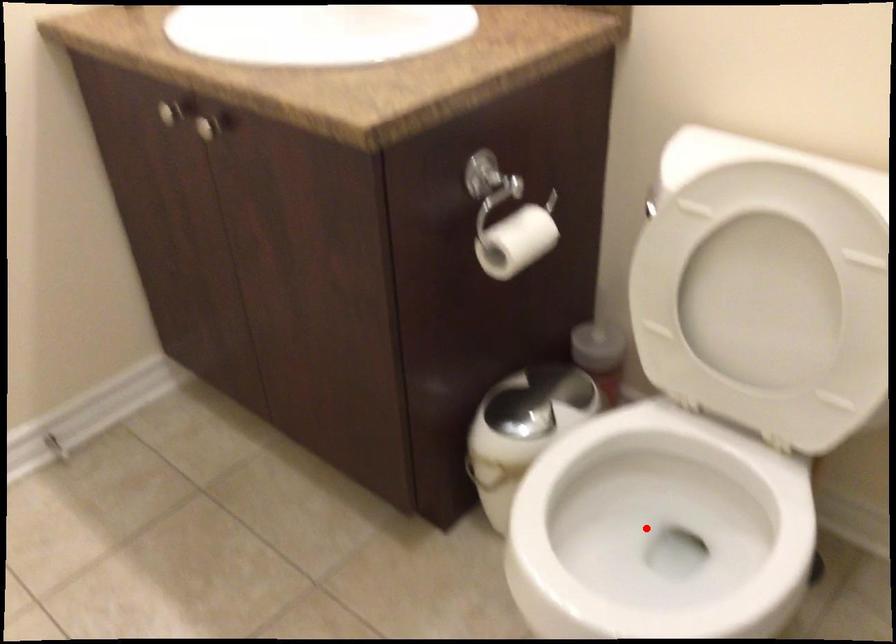
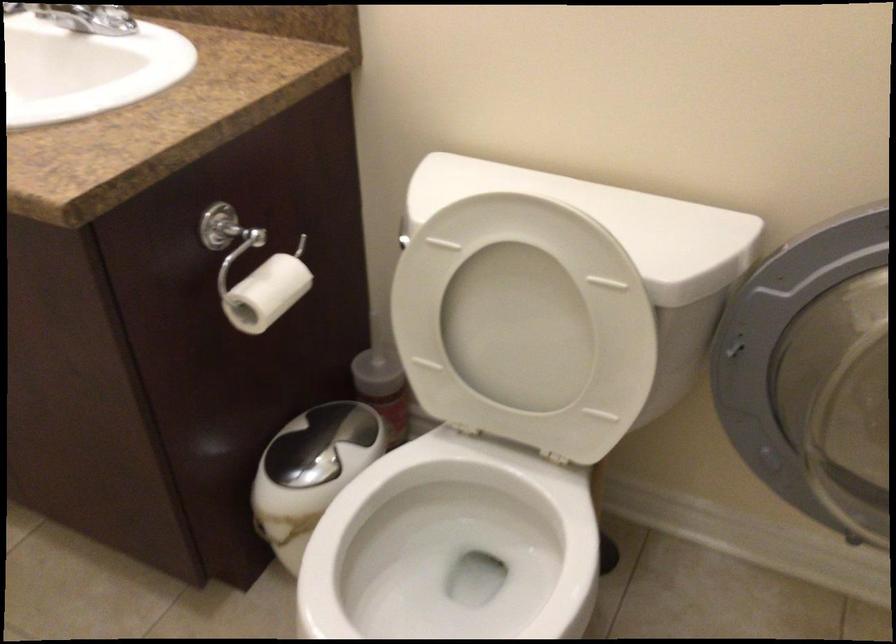
Locate, in the second image, the point that corresponds to the highlighted location in the first image.

(449, 564)